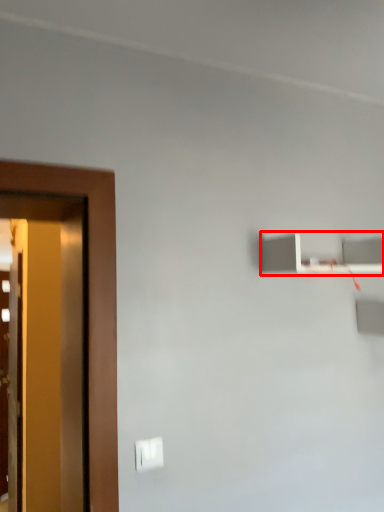
Question: Where is shelf (annotated by the red box) located in relation to light switch in the image?

Choices:
 (A) right
 (B) left

Answer: (A)